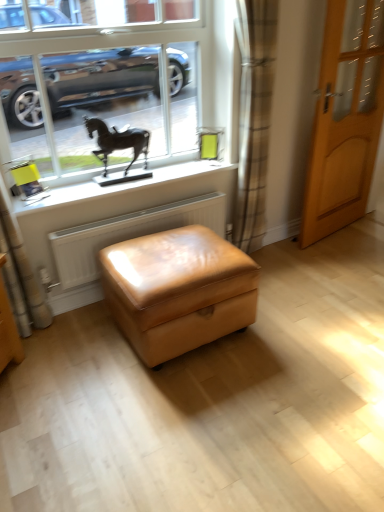
This screenshot has width=384, height=512. I want to click on vacant area in front of leather ottoman at center, so click(x=187, y=417).